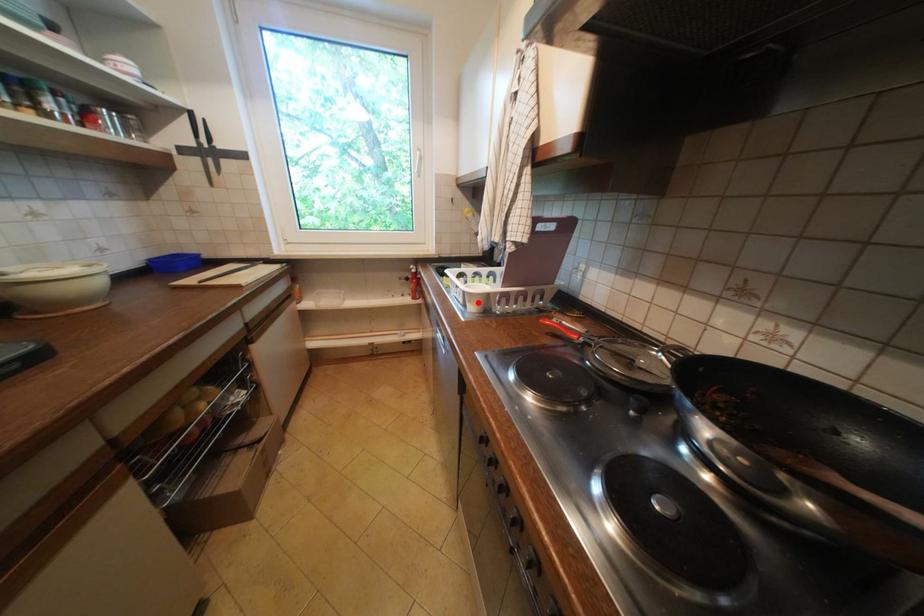
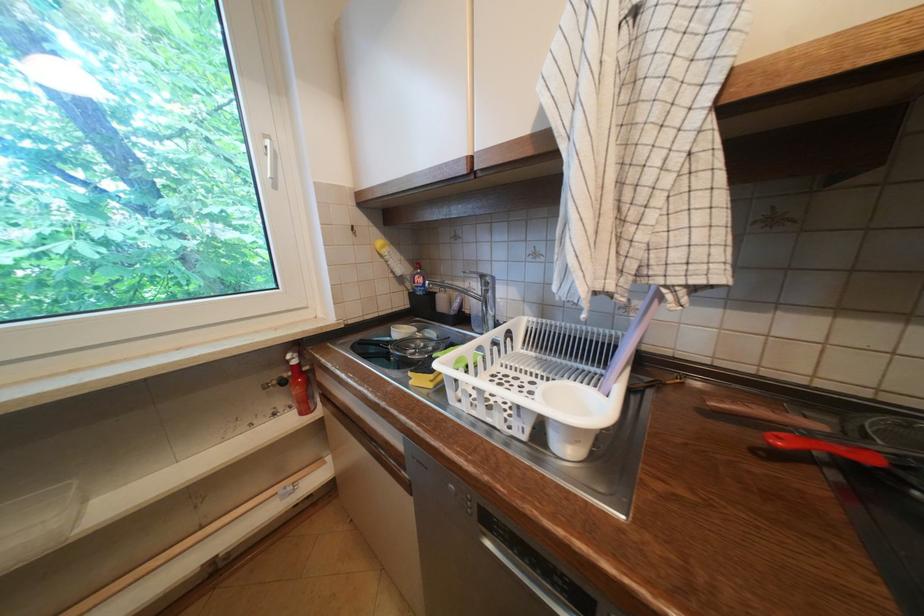
Find the pixel in the second image that matches the highlighted location in the first image.

(586, 443)